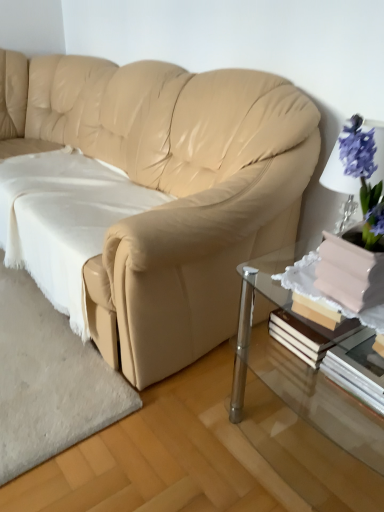
Question: Choose the correct answer: Is white paper book at lower right inside beige leather couch at center or outside it?

Choices:
 (A) outside
 (B) inside

Answer: (A)

Question: In terms of height, does white paper book at lower right look taller or shorter compared to beige leather couch at center?

Choices:
 (A) tall
 (B) short

Answer: (B)

Question: Based on their relative distances, which object is farther from the white paper book at lower right?

Choices:
 (A) white soft fabric at lower left
 (B) clear glass table at lower right
 (C) beige leather couch at center

Answer: (A)

Question: Estimate the real-world distances between objects in this image. Which object is farther from the white paper book at lower right?

Choices:
 (A) clear glass table at lower right
 (B) beige leather couch at center
 (C) white soft fabric at lower left

Answer: (C)